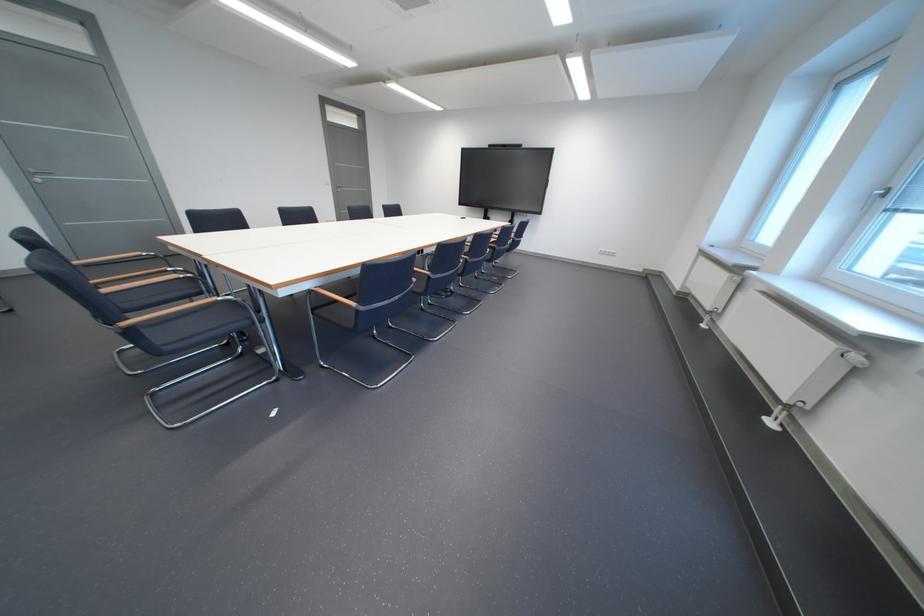
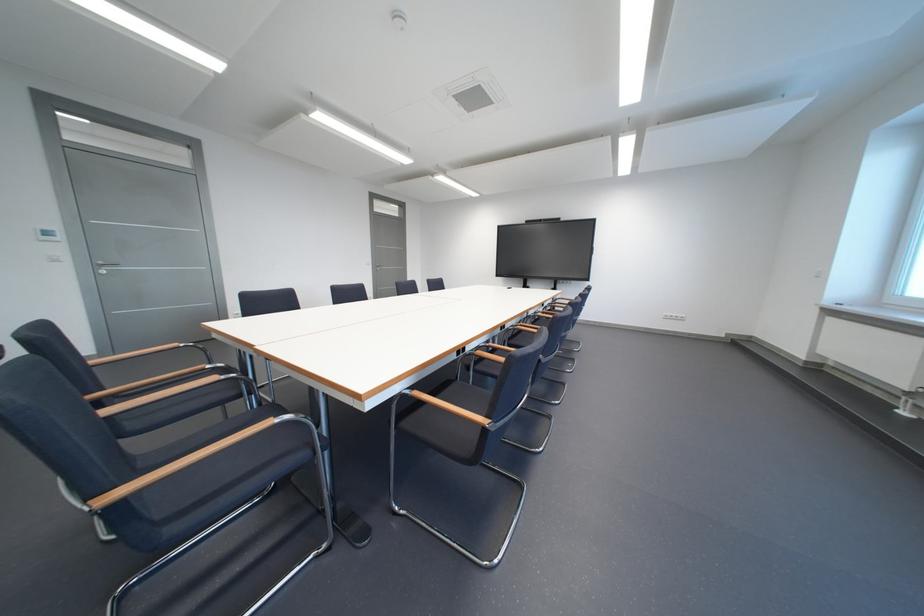
Question: Based on the continuous images, in which direction is the camera rotating? Reply with the corresponding letter.

Choices:
 (A) Left
 (B) Right
 (C) Up
 (D) Down

Answer: (C)